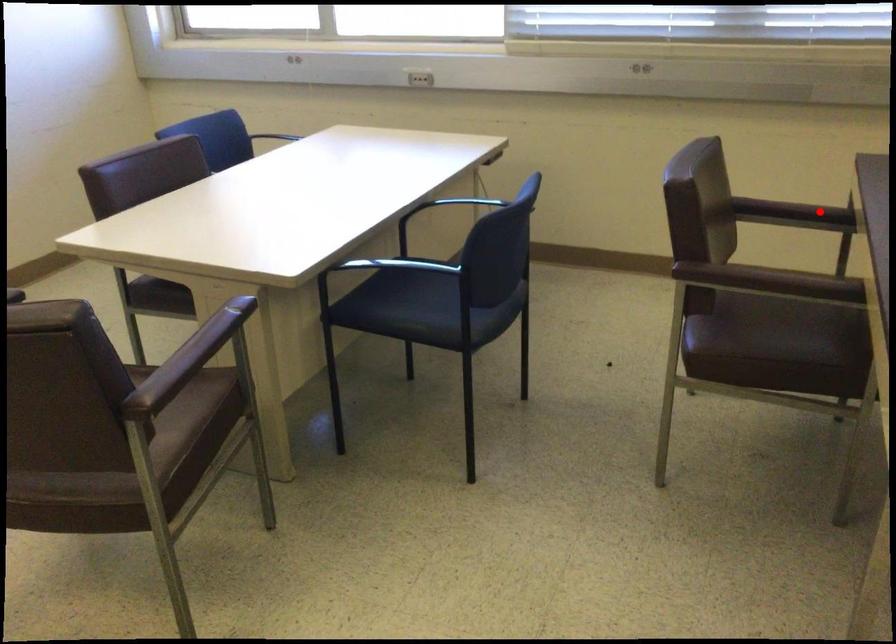
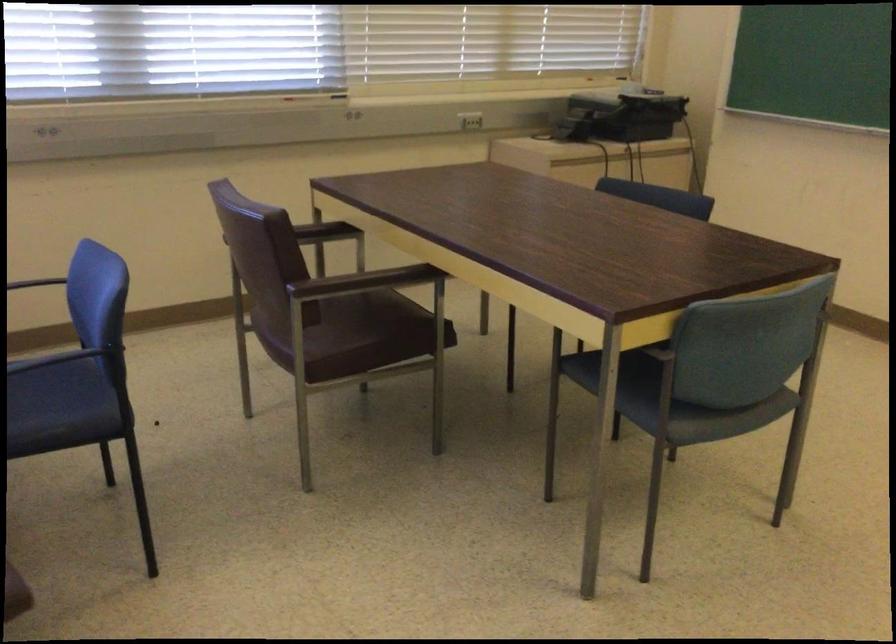
Find the pixel in the second image that matches the highlighted location in the first image.

(323, 232)